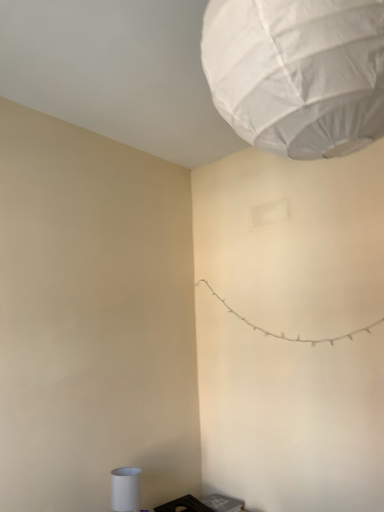
At what (x,y) coordinates should I click in order to perform the action: click on black plastic laptop at lower right. Please return your answer as a coordinate pair (x, y). Image resolution: width=384 pixels, height=512 pixels. Looking at the image, I should click on (201, 504).

Can you confirm if white fabric lantern at upper center is shorter than black plastic laptop at lower right?

No, white fabric lantern at upper center is not shorter than black plastic laptop at lower right.

Is white fabric lantern at upper center to the left of black plastic laptop at lower right from the viewer's perspective?

Incorrect, white fabric lantern at upper center is not on the left side of black plastic laptop at lower right.

Which is nearer, (281,140) or (221,497)?

Point (281,140) is positioned closer to the camera compared to point (221,497).

Is white fabric lantern at upper center far from black plastic laptop at lower right?

Yes, white fabric lantern at upper center is far from black plastic laptop at lower right.

Is black plastic laptop at lower right positioned with its back to white fabric lantern at upper center?

That's not correct — black plastic laptop at lower right is not looking away from white fabric lantern at upper center.

From a real-world perspective, which is physically above, black plastic laptop at lower right or white fabric lantern at upper center?

From a 3D spatial view, white fabric lantern at upper center is above.

Is black plastic laptop at lower right smaller than white fabric lantern at upper center?

Yes, black plastic laptop at lower right is smaller than white fabric lantern at upper center.

Is black plastic laptop at lower right at the left side of white fabric lantern at upper center?

Yes.

Considering the sizes of white matte cylinder at lower left and black plastic laptop at lower right in the image, is white matte cylinder at lower left taller or shorter than black plastic laptop at lower right?

Considering their sizes, white matte cylinder at lower left has more height than black plastic laptop at lower right.

Can you tell me how much white matte cylinder at lower left and black plastic laptop at lower right differ in facing direction?

They differ by 2.54 degrees in their facing directions.

Can you confirm if white matte cylinder at lower left is thinner than black plastic laptop at lower right?

Yes.

From the image's perspective, between white matte cylinder at lower left and black plastic laptop at lower right, who is located below?

From the image's view, black plastic laptop at lower right is below.

Based on the photo, considering the relative sizes of black plastic laptop at lower right and white matte cylinder at lower left in the image provided, is black plastic laptop at lower right smaller than white matte cylinder at lower left?

Actually, black plastic laptop at lower right might be larger than white matte cylinder at lower left.

Which is correct: black plastic laptop at lower right is inside white matte cylinder at lower left, or outside of it?

black plastic laptop at lower right is located beyond the bounds of white matte cylinder at lower left.

Which object is further away from the camera taking this photo, black plastic laptop at lower right or white matte cylinder at lower left?

Positioned behind is black plastic laptop at lower right.

From the image's perspective, who appears lower, black plastic laptop at lower right or white matte cylinder at lower left?

black plastic laptop at lower right appears lower in the image.

Relative to white matte cylinder at lower left, is white fabric lantern at upper center in front or behind?

In the image, white fabric lantern at upper center appears in front of white matte cylinder at lower left.

Is white fabric lantern at upper center taller or shorter than white matte cylinder at lower left?

white fabric lantern at upper center is taller than white matte cylinder at lower left.

Which is less distant, (x=297, y=152) or (x=138, y=479)?

The point (x=297, y=152) is in front.

In the scene shown: Is white matte cylinder at lower left directly adjacent to white fabric lantern at upper center?

white matte cylinder at lower left is not next to white fabric lantern at upper center, and they're not touching.

Does point (138, 510) come behind point (247, 74)?

That is True.

Is white matte cylinder at lower left taller than white fabric lantern at upper center?

No.

Which is in front, white matte cylinder at lower left or white fabric lantern at upper center?

white fabric lantern at upper center is closer to the camera.

Identify the location of furniture on the left of white fabric lantern at upper center. The height and width of the screenshot is (512, 384). (201, 504).

Identify the location of furniture that is under the white fabric lantern at upper center (from a real-world perspective). The height and width of the screenshot is (512, 384). (201, 504).

Based on their spatial positions, is black plastic laptop at lower right or white matte cylinder at lower left closer to white fabric lantern at upper center?

white matte cylinder at lower left is closer to white fabric lantern at upper center.

Which object lies further to the anchor point white fabric lantern at upper center, white matte cylinder at lower left or black plastic laptop at lower right?

black plastic laptop at lower right lies further to white fabric lantern at upper center than the other object.

Estimate the real-world distances between objects in this image. Which object is further from white matte cylinder at lower left, black plastic laptop at lower right or white fabric lantern at upper center?

Among the two, white fabric lantern at upper center is located further to white matte cylinder at lower left.

From the image, which object appears to be nearer to white matte cylinder at lower left, white fabric lantern at upper center or black plastic laptop at lower right?

The object closer to white matte cylinder at lower left is black plastic laptop at lower right.

Considering their positions, is white fabric lantern at upper center positioned closer to black plastic laptop at lower right than white matte cylinder at lower left?

Among the two, white matte cylinder at lower left is located nearer to black plastic laptop at lower right.

When comparing their distances from black plastic laptop at lower right, does white matte cylinder at lower left or white fabric lantern at upper center seem further?

Based on the image, white fabric lantern at upper center appears to be further to black plastic laptop at lower right.

In order to click on lamp that lies between white fabric lantern at upper center and black plastic laptop at lower right from top to bottom in this screenshot , I will do `click(125, 489)`.